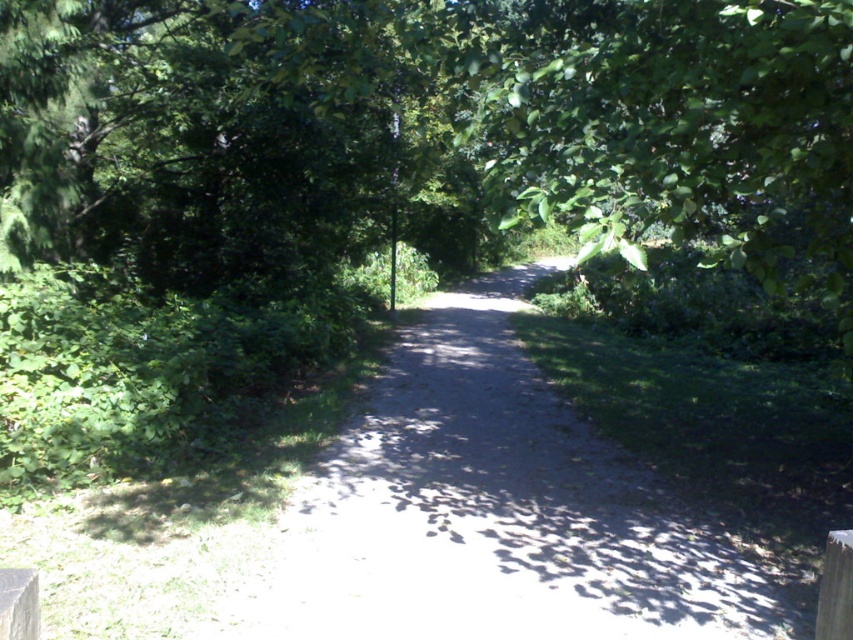
You are a hiker carrying a backpack that is 1.5 meters wide. You need to pass through the gap between the brown wooden post at lower right and the smooth gray wood at lower left. Can your backpack fit through the gap without touching either side?

The gap between the brown wooden post at lower right and the smooth gray wood at lower left is 1.84 meters. Since your backpack is 1.5 meters wide, there is enough space for it to pass through without touching either side.

You are a hiker carrying a large backpack and need to decide whether to walk along the dirt path at center or around the brown wooden post at lower right. Based on their sizes, which option provides more space for your backpack?

The dirt path at center is bigger than the brown wooden post at lower right, so walking along the dirt path at center provides more space for your backpack.

You are a hiker walking along the path and notice two markers ahead. The first is a brown wooden post at lower right, and the second is a smooth gray wood at lower left. Which marker is located to the right of the other?

The brown wooden post at lower right is positioned on the right side of smooth gray wood at lower left.